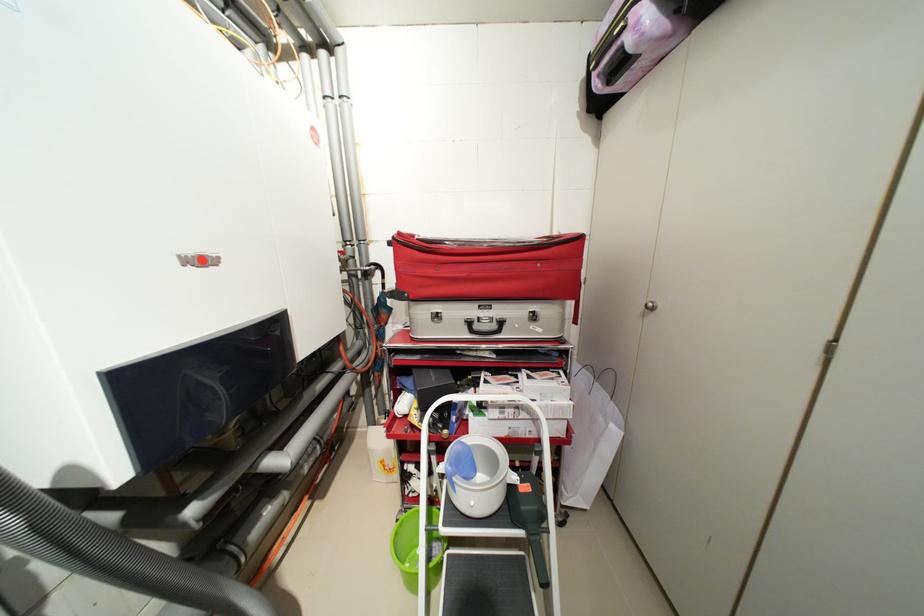
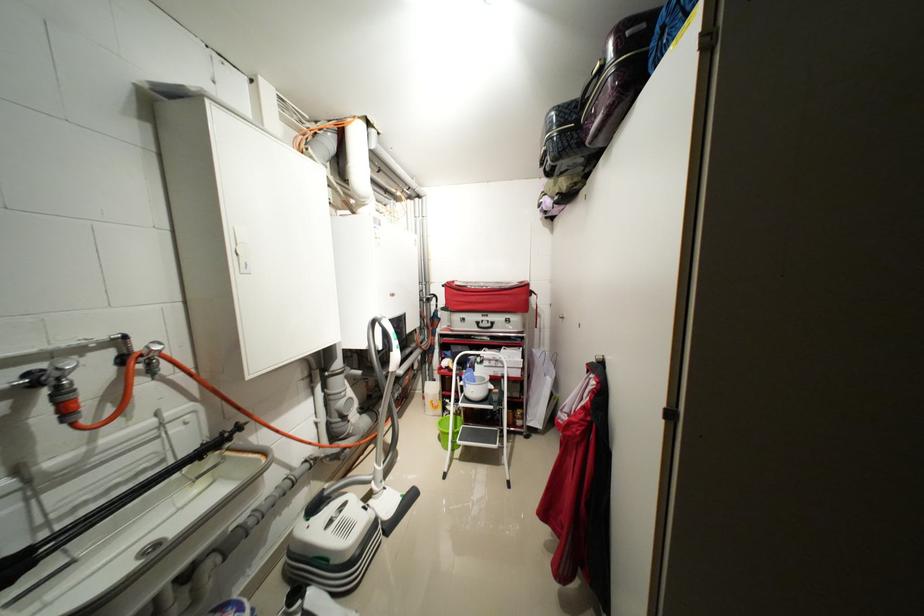
Find the pixel in the second image that matches the point at 502,326 in the first image.

(496, 326)